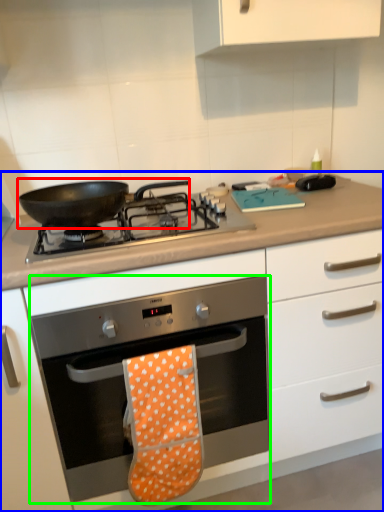
Question: Which object is positioned closest to kitchen appliance (highlighted by a red box)? Select from cabinetry (highlighted by a blue box) and oven (highlighted by a green box).

Choices:
 (A) cabinetry
 (B) oven

Answer: (B)